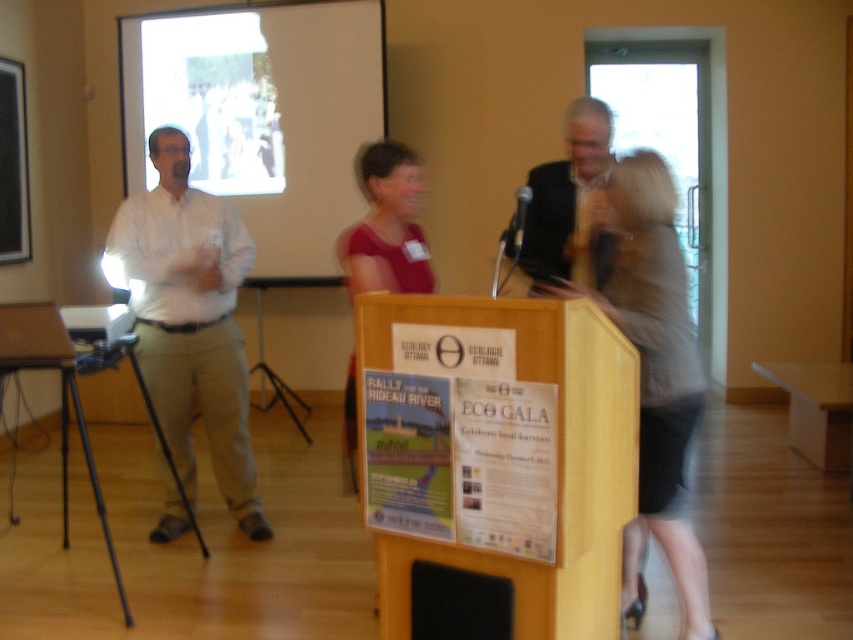
You are standing at the point with coordinates point (161,308) in the conference room. There is another point at point (322,115). Which direction would you face to look towards the point that is behind the other point?

Point (322,115) is behind point (161,308). To look towards the point that is behind, you would face towards point (322,115) from point (161,308).

You are standing in the conference room and want to know if the point at coordinate (381, 147) is closer to you than the point at (416, 572). Can you determine this based on the scene?

Point (381, 147) is further to the camera than point (416, 572), so the point at (416, 572) is closer to you.

You are a speaker at an event and need to adjust your microphone. You see the white matte projection screen at upper center and the black plastic microphone at center. Which object is positioned higher?

The white matte projection screen at upper center is located above the black plastic microphone at center, so it is positioned higher.